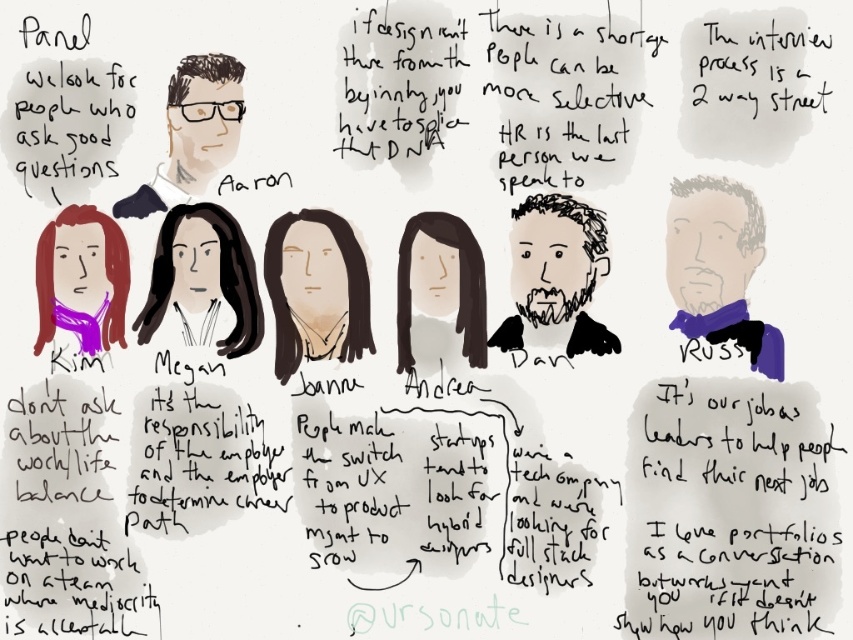
You are organizing a virtual meeting and need to ensure that all participants can see both the white paper at lower right and the matte black hair at center clearly. Considering their sizes, which object might require zooming in to be better seen by participants?

The matte black hair at center might require zooming in because the white paper at lower right has a greater height compared to matte black hair at center, making the hair smaller and harder to see without magnification.

You are organizing a panel discussion and need to place a name tag on the white paper at lower right and the purple fabric shirt at right. Since you want the name tags to be visible from a distance, which object should you place the larger name tag on?

The white paper at lower right is larger in size than the purple fabric shirt at right, so the larger name tag should be placed on the white paper at lower right to ensure visibility from a distance.

You are organizing a virtual meeting and need to ensure that all participants can see the white paper at lower right and the purple fabric shirt at right clearly. Based on their positions, which object should be placed closer to the camera to ensure better visibility?

The white paper at lower right should be placed closer to the camera since it is in front of the purple fabric shirt at right, making it already nearer to the viewer.